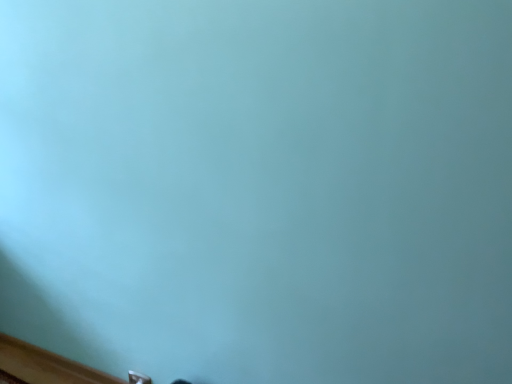
In order to face metallic silver door handle at lower left, should I rotate leftwards or rightwards?

To align with it, rotate left about 14.954°.

The image size is (512, 384). Describe the element at coordinates (138, 378) in the screenshot. I see `metallic silver door handle at lower left` at that location.

The width and height of the screenshot is (512, 384). Find the location of `metallic silver door handle at lower left`. metallic silver door handle at lower left is located at coordinates (138, 378).

Locate an element on the screen. metallic silver door handle at lower left is located at coordinates (138, 378).